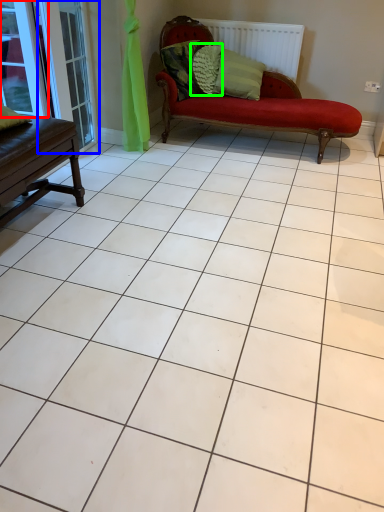
Question: Which is farther away from window (highlighted by a red box)? screen door (highlighted by a blue box) or pillow (highlighted by a green box)?

Choices:
 (A) screen door
 (B) pillow

Answer: (B)